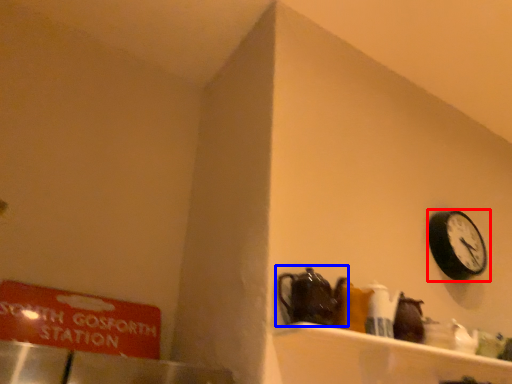
Question: Among these objects, which one is nearest to the camera, wall clock (highlighted by a red box) or tea pot (highlighted by a blue box)?

Choices:
 (A) wall clock
 (B) tea pot

Answer: (B)